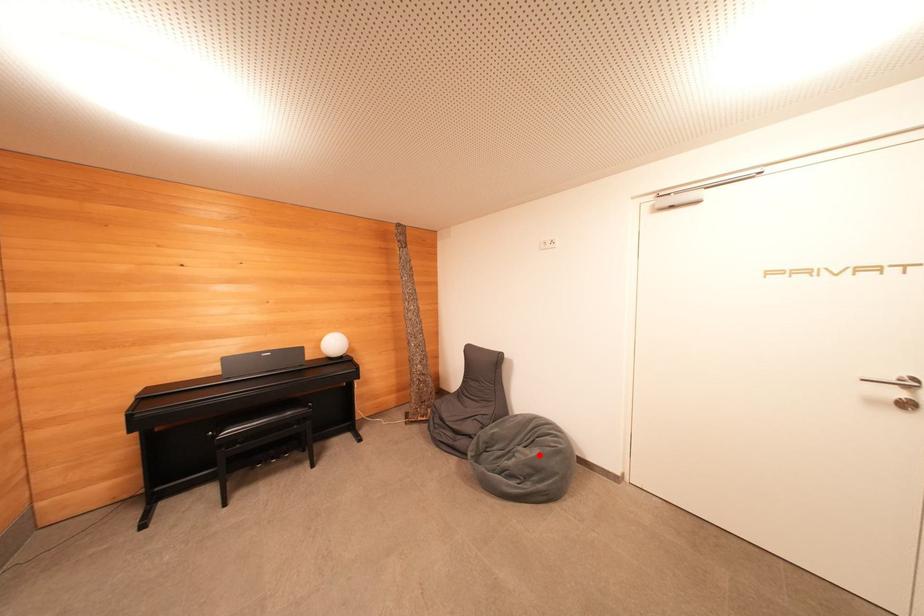
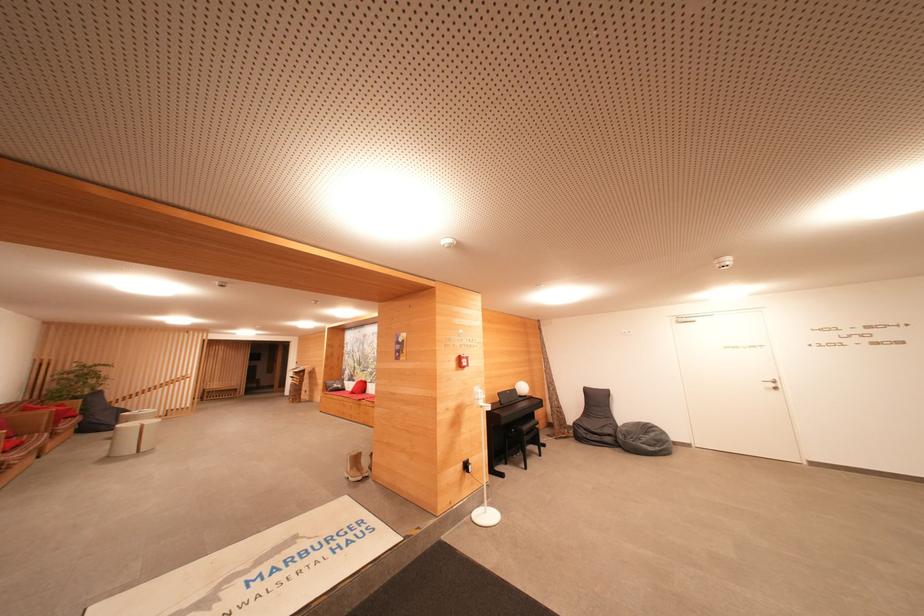
Where in the second image is the point corresponding to the highlighted location from the first image?

(655, 438)